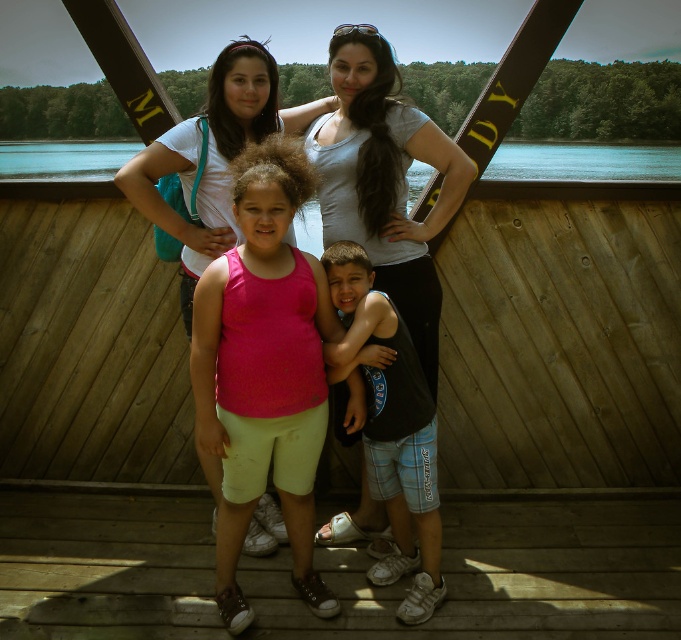
Between point (206, 540) and point (200, 451), which one is positioned in front?

Point (200, 451) is in front.

Does brown wooden deck at center have a larger size compared to matte white tank top at center?

Yes.

This screenshot has height=640, width=681. In order to click on brown wooden deck at center in this screenshot , I will do `click(503, 577)`.

Locate an element on the screen. This screenshot has width=681, height=640. brown wooden deck at center is located at coordinates (503, 577).

Is point (72, 576) positioned before point (426, 166)?

Yes, it is.

What do you see at coordinates (503, 577) in the screenshot? The image size is (681, 640). I see `brown wooden deck at center` at bounding box center [503, 577].

Describe the element at coordinates (503, 577) in the screenshot. This screenshot has height=640, width=681. I see `brown wooden deck at center` at that location.

The height and width of the screenshot is (640, 681). Identify the location of brown wooden deck at center. (503, 577).

Is pink fabric tank top at center taller than matte white tank top at center?

Indeed, pink fabric tank top at center has a greater height compared to matte white tank top at center.

Between pink fabric tank top at center and matte white tank top at center, which one appears on the left side from the viewer's perspective?

From the viewer's perspective, matte white tank top at center appears more on the left side.

Which is in front, point (240, 195) or point (274, 92)?

Positioned in front is point (240, 195).

Locate an element on the screen. This screenshot has height=640, width=681. pink fabric tank top at center is located at coordinates (264, 369).